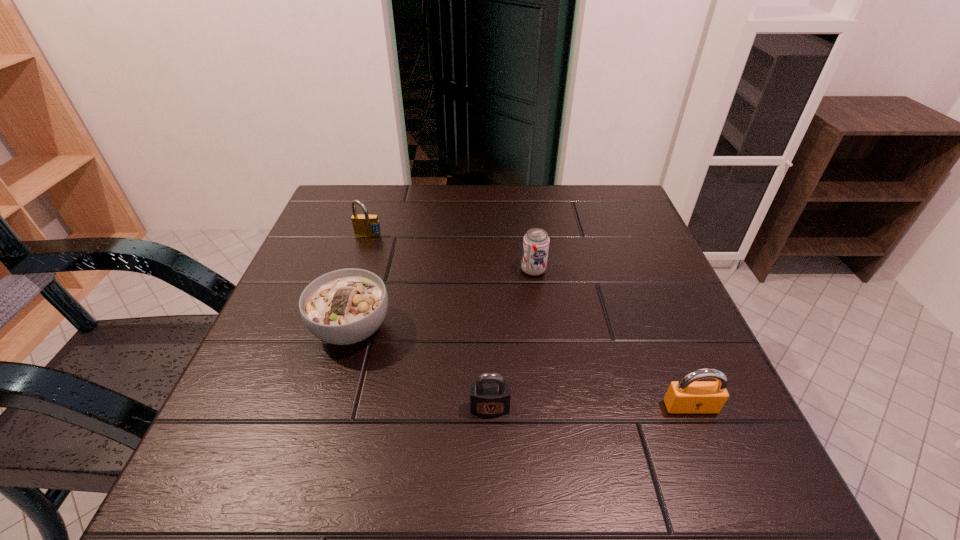
I want to click on free area in between the rightmost padlock and the third object from right to left, so click(x=590, y=407).

This screenshot has width=960, height=540. Find the location of `free space between the second padlock from right to left and the third farthest object`. free space between the second padlock from right to left and the third farthest object is located at coordinates (420, 368).

This screenshot has height=540, width=960. Identify the location of free space between the fourth object from left to right and the rightmost object. (612, 339).

Find the location of a particular element. The width and height of the screenshot is (960, 540). free point between the rightmost object and the fourth nearest object is located at coordinates (612, 339).

Identify the location of object that is the closest to the farthest padlock. This screenshot has height=540, width=960. (346, 306).

This screenshot has height=540, width=960. Identify the location of the third closest object to the fourth nearest object. (687, 395).

Image resolution: width=960 pixels, height=540 pixels. What are the coordinates of `the closest padlock to the rightmost padlock` in the screenshot? It's located at (489, 398).

Identify which padlock is the closest to the third object from left to right. Please provide its 2D coordinates. Your answer should be formatted as a tuple, i.e. [(x, y)], where the tuple contains the x and y coordinates of a point satisfying the conditions above.

[(687, 395)]